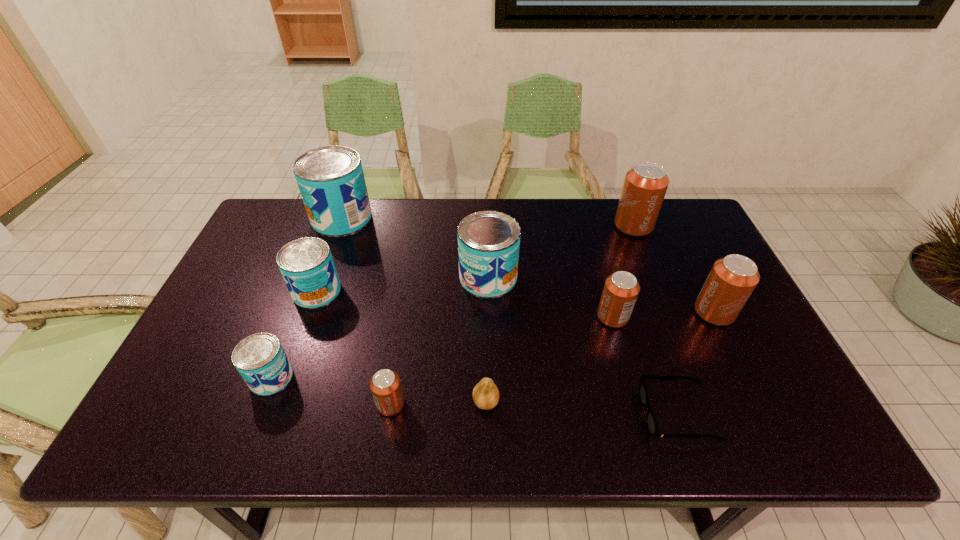
I want to click on vacant region located on the right of the third biggest blue can, so click(x=459, y=291).

The width and height of the screenshot is (960, 540). I want to click on blank area located 0.390m on the left of the sixth can from left to right, so click(x=453, y=317).

Where is `vacant region located 0.150m on the back of the pear`? Image resolution: width=960 pixels, height=540 pixels. vacant region located 0.150m on the back of the pear is located at coordinates (485, 339).

Where is `vacant area situated on the right of the smallest blue can`? vacant area situated on the right of the smallest blue can is located at coordinates (359, 377).

In order to click on vacant space located 0.080m on the right of the fifth can from right to left in this screenshot , I will do `click(440, 404)`.

Locate an element on the screen. The image size is (960, 540). vacant area situated on the arms of the black spectacles is located at coordinates (609, 415).

At what (x,y) coordinates should I click in order to perform the action: click on free space located 0.130m on the arms of the black spectacles. Please return your answer as a coordinate pair (x, y). Image resolution: width=960 pixels, height=540 pixels. Looking at the image, I should click on (587, 415).

In order to click on free space located 0.260m on the arms of the black spectacles in this screenshot , I will do `click(529, 415)`.

The width and height of the screenshot is (960, 540). Find the location of `pear that is at the near edge`. pear that is at the near edge is located at coordinates (485, 394).

The width and height of the screenshot is (960, 540). Identify the location of can located in the near edge section of the desktop. (385, 385).